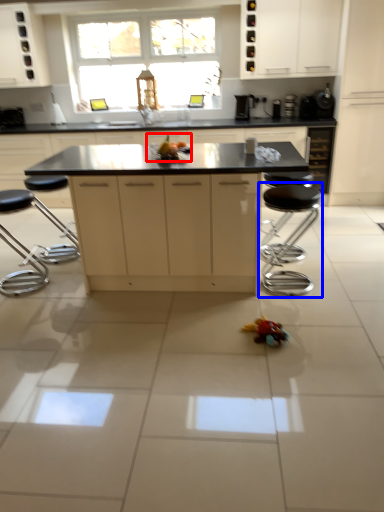
Question: Which of the following is the farthest to the observer, toy (highlighted by a red box) or bar stool (highlighted by a blue box)?

Choices:
 (A) toy
 (B) bar stool

Answer: (A)